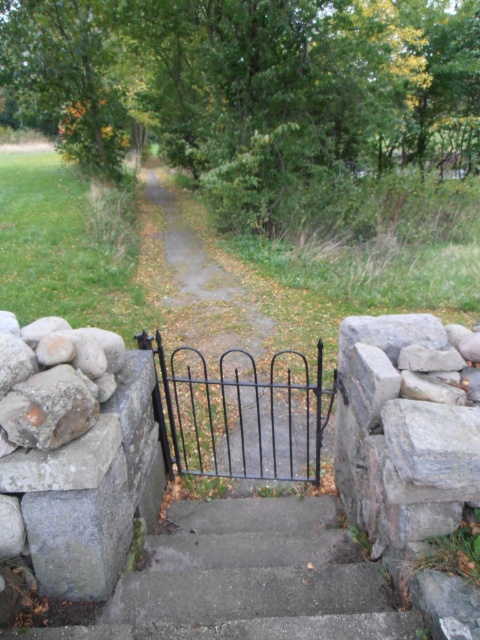
Question: Does concrete stairs at center appear under black wrought iron gate at center?

Choices:
 (A) yes
 (B) no

Answer: (A)

Question: Considering the real-world distances, which object is farthest from the gray rough stone at right?

Choices:
 (A) black metal gate at center
 (B) black wrought iron gate at center
 (C) concrete stairs at center

Answer: (A)

Question: Which object appears closest to the camera in this image?

Choices:
 (A) black wrought iron gate at center
 (B) black metal gate at center
 (C) concrete stairs at center
 (D) gray rough stone at right

Answer: (C)

Question: Can you confirm if concrete stairs at center is wider than black wrought iron gate at center?

Choices:
 (A) yes
 (B) no

Answer: (B)

Question: Which object appears farthest from the camera in this image?

Choices:
 (A) concrete stairs at center
 (B) gray rough stone at right
 (C) black wrought iron gate at center

Answer: (C)

Question: Is concrete stairs at center above black wrought iron gate at center?

Choices:
 (A) no
 (B) yes

Answer: (A)